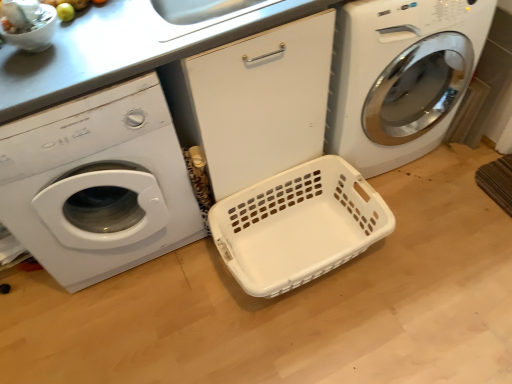
Question: Is white plastic basket at center facing away from white plastic washing machine at left, which is the 1th washing machine from left to right?

Choices:
 (A) yes
 (B) no

Answer: (B)

Question: Is white plastic washing machine at left, which is the 1th washing machine from left to right, completely or partially inside white plastic basket at center?

Choices:
 (A) yes
 (B) no

Answer: (B)

Question: Is white plastic basket at center far from white plastic washing machine at left, which is the 1th washing machine from left to right?

Choices:
 (A) no
 (B) yes

Answer: (A)

Question: Is white plastic basket at center bigger than white plastic washing machine at left, the second washing machine from the right?

Choices:
 (A) yes
 (B) no

Answer: (B)

Question: From a real-world perspective, is white plastic basket at center over white plastic washing machine at left, which is the 1th washing machine from left to right?

Choices:
 (A) no
 (B) yes

Answer: (A)

Question: Does point (273, 279) appear closer or farther from the camera than point (368, 69)?

Choices:
 (A) closer
 (B) farther

Answer: (B)

Question: Would you say white plastic basket at center is inside or outside white glossy washing machine at center, marked as the 1th washing machine in a right-to-left arrangement?

Choices:
 (A) outside
 (B) inside

Answer: (A)

Question: From a real-world perspective, is white plastic basket at center physically located above or below white glossy washing machine at center, marked as the 1th washing machine in a right-to-left arrangement?

Choices:
 (A) below
 (B) above

Answer: (A)

Question: Considering the relative positions of white plastic basket at center and white glossy washing machine at center, marked as the 1th washing machine in a right-to-left arrangement, in the image provided, is white plastic basket at center to the left or to the right of white glossy washing machine at center, marked as the 1th washing machine in a right-to-left arrangement,?

Choices:
 (A) left
 (B) right

Answer: (A)

Question: From the image's perspective, is white glossy washing machine at center, the 2th washing machine viewed from the left, positioned above or below white plastic basket at center?

Choices:
 (A) below
 (B) above

Answer: (B)

Question: Is point (357, 120) positioned closer to the camera than point (219, 203)?

Choices:
 (A) closer
 (B) farther

Answer: (A)

Question: Based on their sizes in the image, would you say white glossy washing machine at center, the 2th washing machine viewed from the left, is bigger or smaller than white plastic basket at center?

Choices:
 (A) big
 (B) small

Answer: (A)

Question: Is white glossy washing machine at center, marked as the 1th washing machine in a right-to-left arrangement, taller or shorter than white plastic basket at center?

Choices:
 (A) short
 (B) tall

Answer: (B)

Question: Relative to white glossy washing machine at center, marked as the 1th washing machine in a right-to-left arrangement, is white plastic washing machine at left, which is the 1th washing machine from left to right, in front or behind?

Choices:
 (A) behind
 (B) front

Answer: (B)

Question: Considering the relative positions of white plastic washing machine at left, the second washing machine from the right, and white glossy washing machine at center, marked as the 1th washing machine in a right-to-left arrangement, in the image provided, is white plastic washing machine at left, the second washing machine from the right, to the left or to the right of white glossy washing machine at center, marked as the 1th washing machine in a right-to-left arrangement,?

Choices:
 (A) left
 (B) right

Answer: (A)